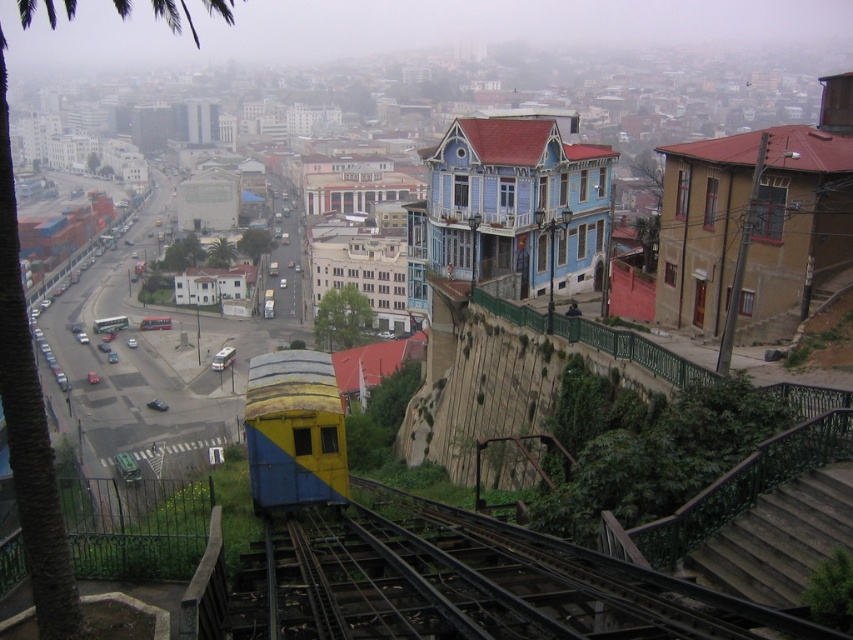
You are standing at the base of the incline and want to walk to the green leafy palm tree at left. The distance between you and the palm tree is 105.45 feet. If you walk at a speed of 3 feet per second, how many seconds will it take you to reach the palm tree?

The distance between you and the green leafy palm tree at left is 105.45 feet. At a walking speed of 3 feet per second, it will take 105.45 divided by 3, which equals approximately 35.15 seconds to reach the palm tree.

You are a passenger on the yellow matte train at center and want to see the green leafy palm tree at left from your window. Is the palm tree visible from your current position?

The green leafy palm tree at left is positioned over the yellow matte train at center, so yes, the palm tree is visible from the train window as it is directly above the train.

You are standing at the point marked by the coordinates (28, 422) in the image. What is the nearest object to you?

The point at (28, 422) is on a green leafy palm tree at left, so the nearest object to you is the green leafy palm tree at left.